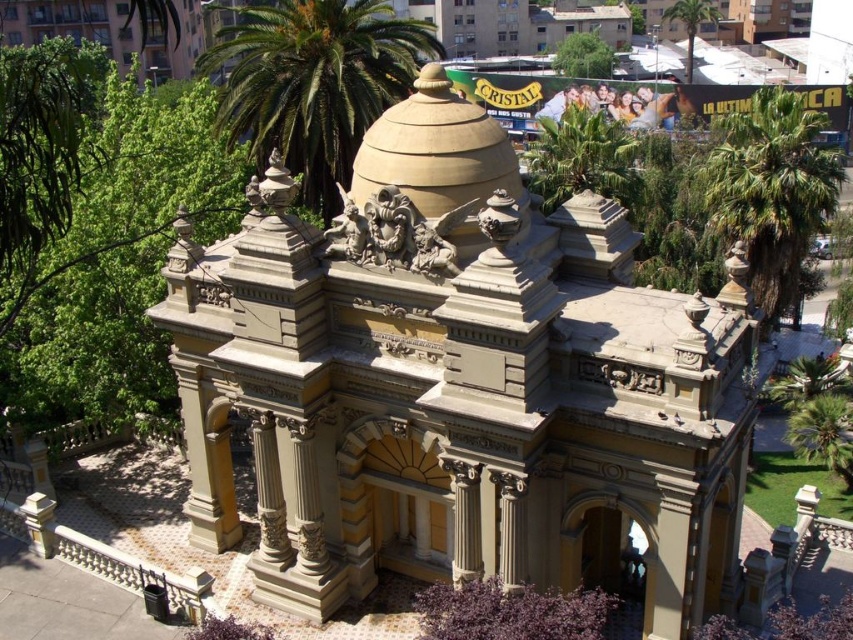
Question: Is green leafy tree at upper center thinner than green leafy palm tree at upper center?

Choices:
 (A) yes
 (B) no

Answer: (A)

Question: In this image, where is green leafy palm at center located relative to green leafy palm tree at lower right?

Choices:
 (A) right
 (B) left

Answer: (B)

Question: Which of the following is the closest to the observer?

Choices:
 (A) (582, 61)
 (B) (300, 157)
 (C) (694, 19)
 (D) (810, 412)

Answer: (D)

Question: Which of these objects is positioned closest to the green leafy palm tree at lower right?

Choices:
 (A) green leafy palm tree at right
 (B) green leafy palm at center
 (C) green leafy tree at upper center

Answer: (A)

Question: Is green leafy palm tree at right bigger than green leafy palm tree at upper center?

Choices:
 (A) yes
 (B) no

Answer: (A)

Question: Which object appears farthest from the camera in this image?

Choices:
 (A) green leafy palm at center
 (B) green leafy palm tree at lower right
 (C) green leafy tree at upper center
 (D) green leafy palm tree at right

Answer: (C)